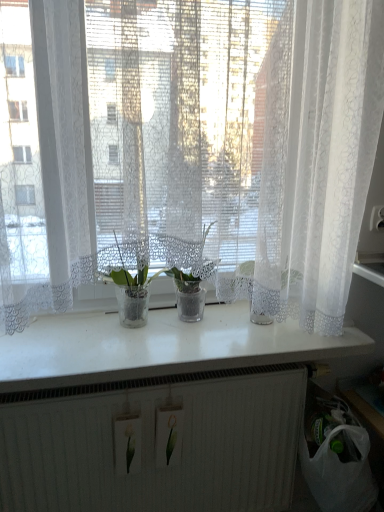
Locate an element on the screen. The width and height of the screenshot is (384, 512). vacant space underneath white lace curtain at center (from a real-world perspective) is located at coordinates (192, 350).